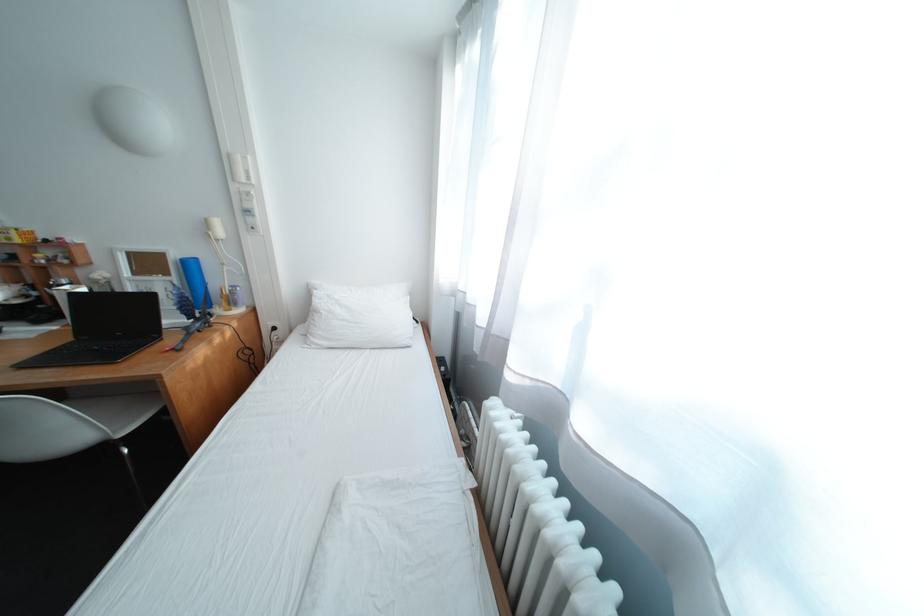
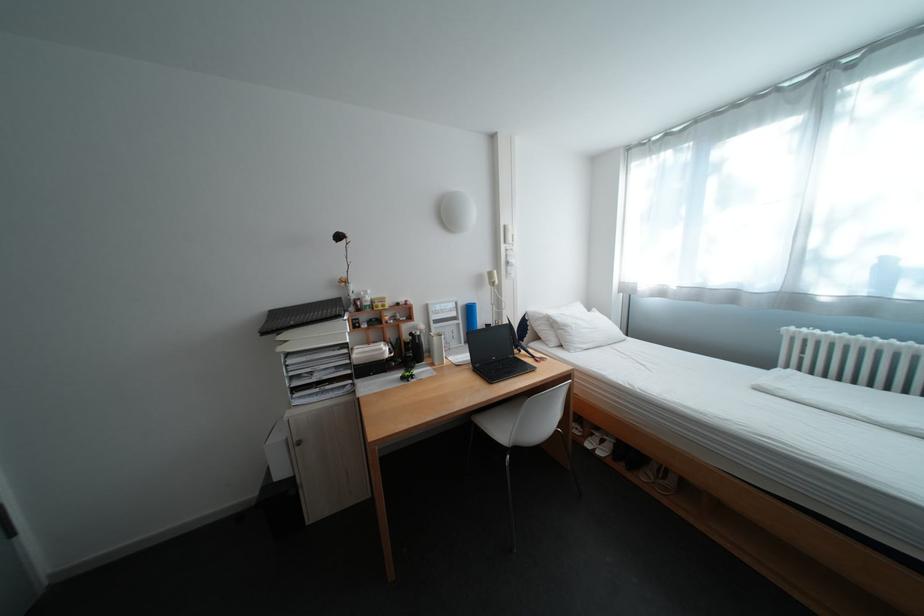
Question: What movement of the cameraman would produce the second image?

Choices:
 (A) Left
 (B) Right
 (C) Forward
 (D) Backward

Answer: (A)